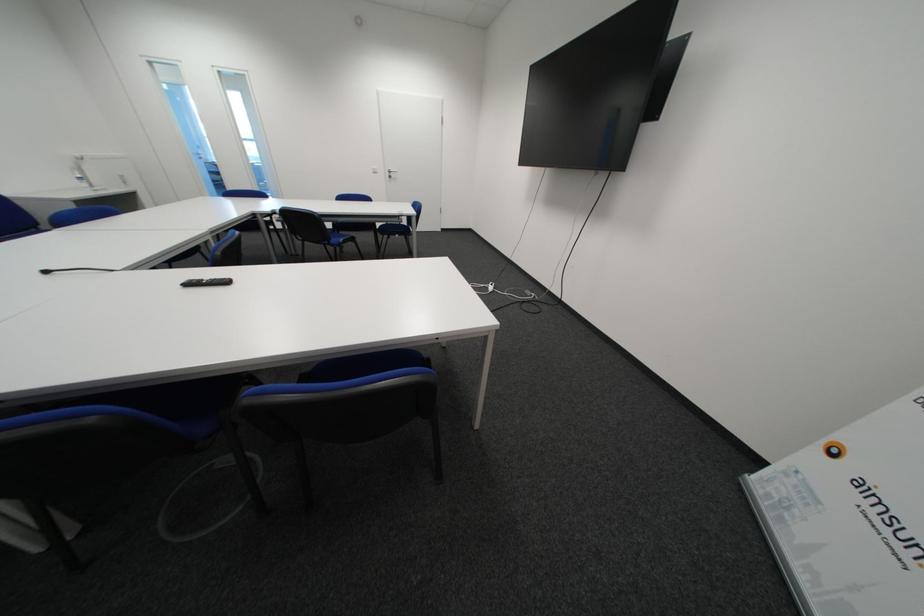
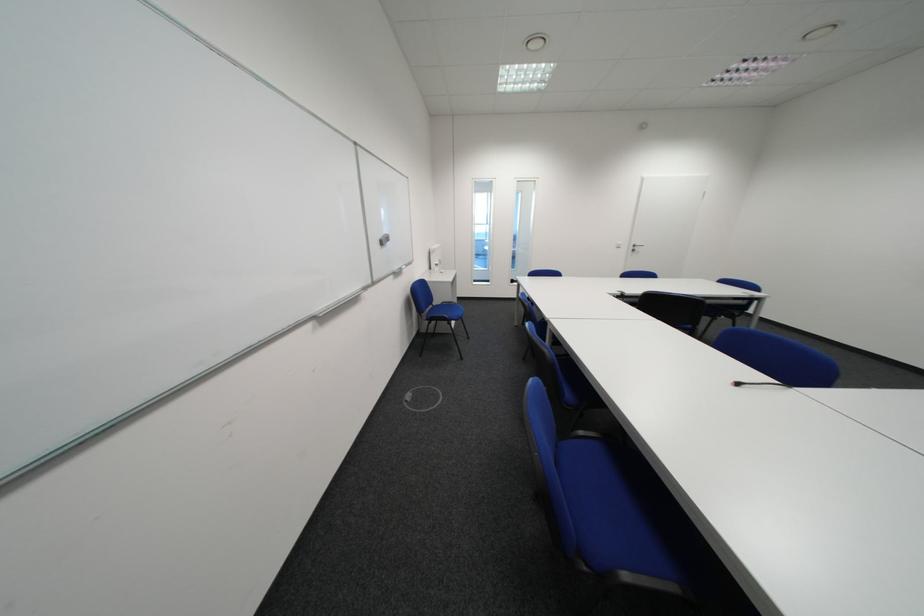
Question: Which direction would the cameraman need to move to produce the second image? Reply with the corresponding letter.

Choices:
 (A) Left
 (B) Right
 (C) Forward
 (D) Backward

Answer: (A)